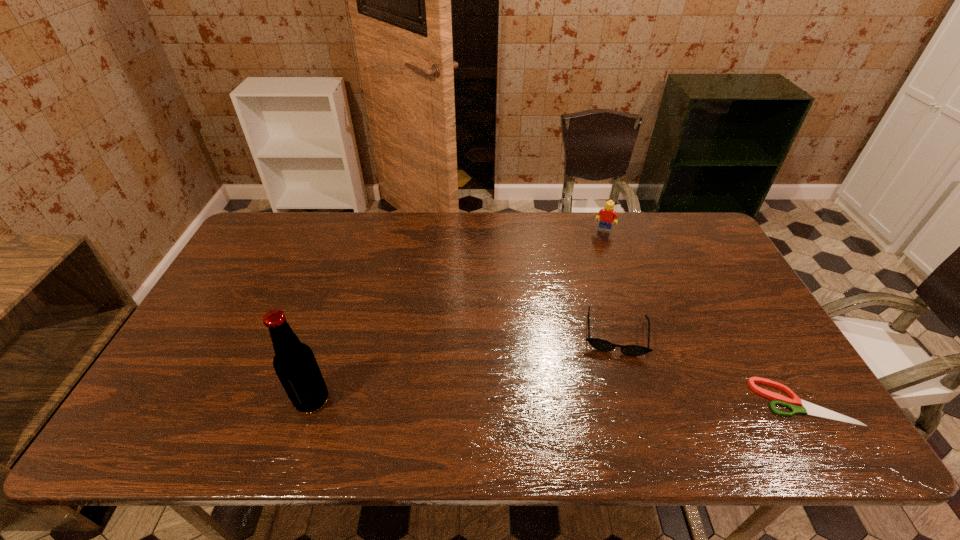
I want to click on vacant space located 0.380m on the front-facing side of the farthest object, so click(576, 307).

The height and width of the screenshot is (540, 960). In order to click on free spot located on the front-facing side of the farthest object in this screenshot , I will do `click(586, 281)`.

Locate an element on the screen. free space located on the front-facing side of the farthest object is located at coordinates (576, 307).

I want to click on free location located 0.060m on the front-facing side of the third tallest object, so click(x=614, y=378).

Where is `free location located on the front-facing side of the third tallest object`? This screenshot has height=540, width=960. free location located on the front-facing side of the third tallest object is located at coordinates (614, 392).

At what (x,y) coordinates should I click in order to perform the action: click on object that is at the far edge. Please return your answer as a coordinate pair (x, y). This screenshot has height=540, width=960. Looking at the image, I should click on (607, 215).

The image size is (960, 540). I want to click on beer bottle positioned at the near edge, so 294,362.

Identify the location of scissors that is at the near edge. This screenshot has height=540, width=960. (794, 404).

Identify the location of object that is at the right edge. The width and height of the screenshot is (960, 540). point(794,404).

Locate an element on the screen. The height and width of the screenshot is (540, 960). object located in the near right corner section of the desktop is located at coordinates (794, 404).